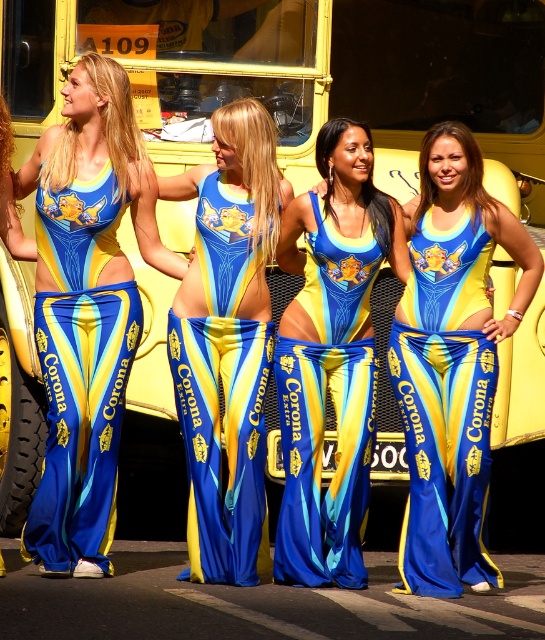
You are a photographer trying to capture the shiny blue fabric bikini at center and the matte blue fabric bikini at center in a single shot. Which of the two bikinis is positioned lower in the frame?

The shiny blue fabric bikini at center is located below the matte blue fabric bikini at center, so it is positioned lower in the frame.

You are a photographer at the scene. You want to take a photo focusing on the shiny blue fabric bikini at center and the blue satin pants at center. Which object should you zoom in on to capture more details without moving the camera?

The shiny blue fabric bikini at center is bigger than blue satin pants at center, so you should zoom in on the shiny blue fabric bikini at center to capture more details since it has a larger surface area.